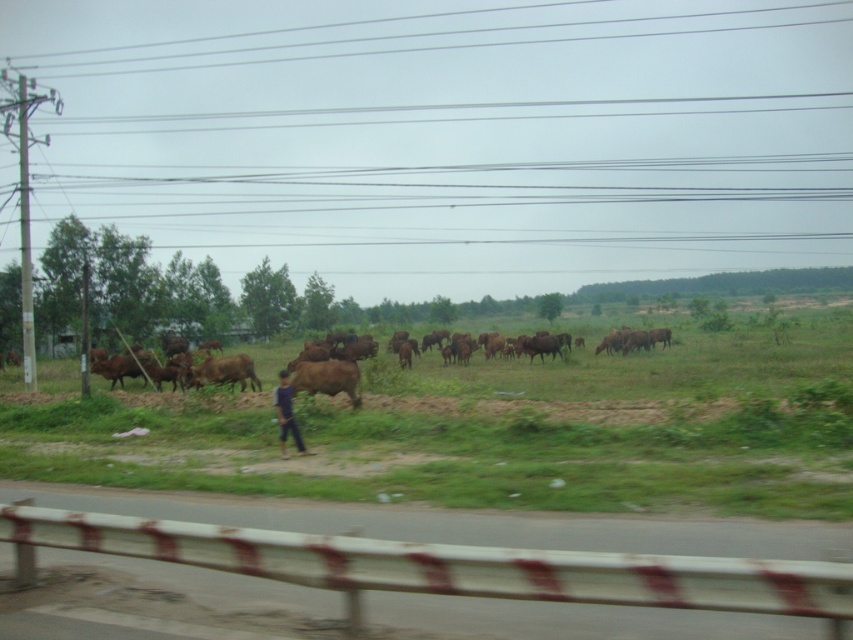
Question: Which of the following is the farthest from the observer?

Choices:
 (A) metallic gray guardrail at lower center
 (B) green grass at center
 (C) blue fabric shirt at center
 (D) brown matte bull at center

Answer: (D)

Question: Is green grass at center positioned in front of metallic gray guardrail at lower center?

Choices:
 (A) no
 (B) yes

Answer: (B)

Question: Which is farther from the metallic gray guardrail at lower center?

Choices:
 (A) blue fabric shirt at center
 (B) brown matte bull at center
 (C) green grass at center

Answer: (C)

Question: Which is nearer to the brown matte bull at center?

Choices:
 (A) green grass at center
 (B) blue fabric shirt at center

Answer: (B)

Question: Does metallic gray guardrail at lower center come in front of blue fabric shirt at center?

Choices:
 (A) yes
 (B) no

Answer: (A)

Question: Can you confirm if green grass at center is smaller than blue fabric shirt at center?

Choices:
 (A) yes
 (B) no

Answer: (B)